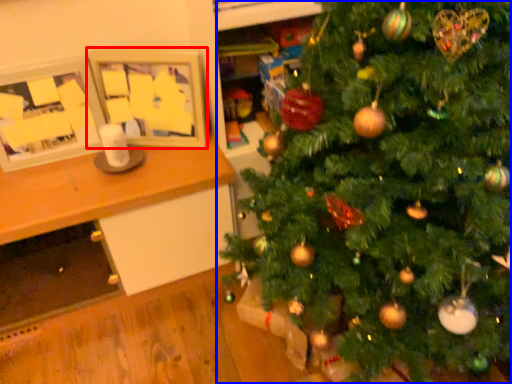
Question: Which point is closer to the camera, picture frame (highlighted by a red box) or christmas tree (highlighted by a blue box)?

Choices:
 (A) picture frame
 (B) christmas tree

Answer: (B)